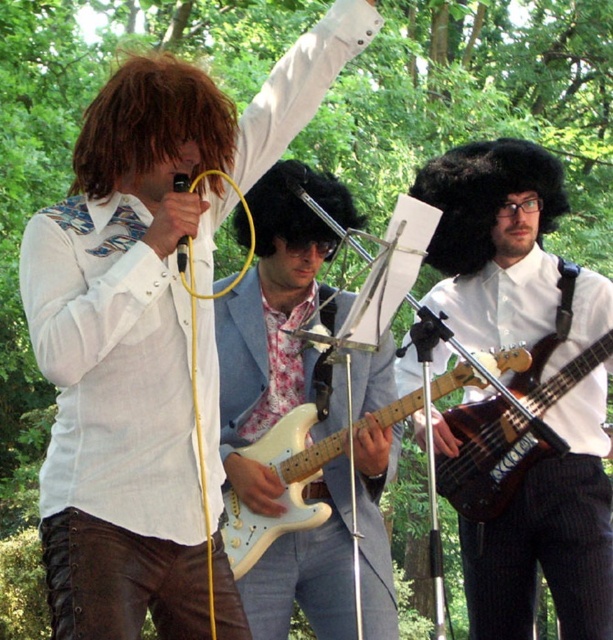
Measure the distance between curly brown hair at center and white glossy electric guitar at center.

A distance of 3.82 feet exists between curly brown hair at center and white glossy electric guitar at center.

The height and width of the screenshot is (640, 613). Describe the element at coordinates (150, 124) in the screenshot. I see `curly brown hair at center` at that location.

This screenshot has height=640, width=613. In order to click on curly brown hair at center in this screenshot , I will do `click(150, 124)`.

Which is above, light blue fabric jacket at center or curly brown hair at center?

Positioned higher is curly brown hair at center.

Is point (327, 474) closer to viewer compared to point (101, 172)?

That is False.

This screenshot has height=640, width=613. Find the location of `light blue fabric jacket at center`. light blue fabric jacket at center is located at coordinates (280, 324).

Is white glossy electric guitar at center shorter than curly black wig at center?

No, white glossy electric guitar at center is not shorter than curly black wig at center.

Is white glossy electric guitar at center above curly black wig at center?

Actually, white glossy electric guitar at center is below curly black wig at center.

Find the location of `white glossy electric guitar at center`. white glossy electric guitar at center is located at coordinates (286, 488).

You are a GUI agent. You are given a task and a screenshot of the screen. Output one action in this format:
    pyautogui.click(x=<x>, y=<y>)
    Task: Click on the white glossy electric guitar at center
    
    Given the screenshot: What is the action you would take?
    pyautogui.click(x=286, y=488)